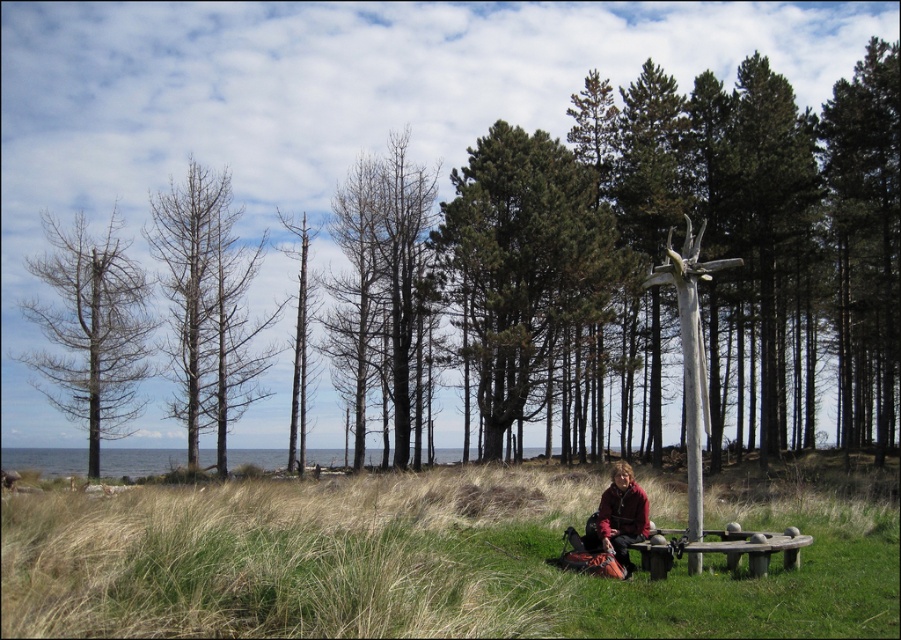
Does bare wood trees at left appear over bare wood tree at left?

Indeed, bare wood trees at left is positioned over bare wood tree at left.

Consider the image. Does bare wood trees at left appear on the right side of bare wood tree at left?

Yes, bare wood trees at left is to the right of bare wood tree at left.

Does point (220, 394) come behind point (98, 372)?

Yes, it is behind point (98, 372).

Locate an element on the screen. This screenshot has height=640, width=901. bare wood trees at left is located at coordinates click(x=207, y=307).

Is the position of green coniferous trees at center less distant than that of bare wood tree at left?

Yes, green coniferous trees at center is closer to the viewer.

Does point (531, 221) come farther from viewer compared to point (68, 266)?

That is False.

Which is behind, point (548, 300) or point (29, 304)?

The point (29, 304) is behind.

At what (x,y) coordinates should I click in order to perform the action: click on green coniferous trees at center. Please return your answer as a coordinate pair (x, y). Looking at the image, I should click on (521, 266).

Does green grass at lower center have a lesser height compared to bare wood trees at left?

Yes, green grass at lower center is shorter than bare wood trees at left.

Who is lower down, green grass at lower center or bare wood trees at left?

green grass at lower center is lower down.

Locate an element on the screen. green grass at lower center is located at coordinates (417, 563).

Locate an element on the screen. The width and height of the screenshot is (901, 640). green grass at lower center is located at coordinates (417, 563).